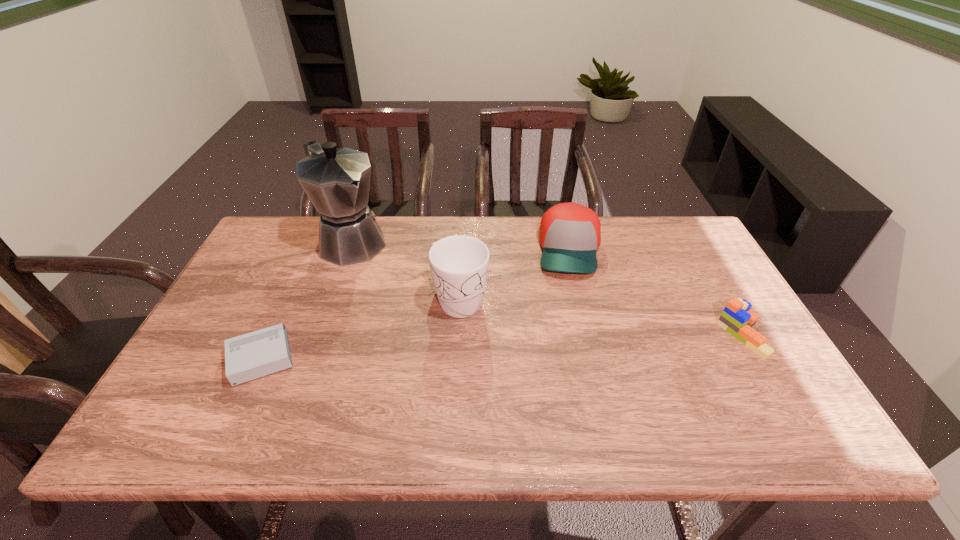
Image resolution: width=960 pixels, height=540 pixels. I want to click on blank region between the rightmost object and the tallest object, so click(x=546, y=288).

The width and height of the screenshot is (960, 540). I want to click on the closest object relative to the second object from right to left, so click(459, 264).

You are a GUI agent. You are given a task and a screenshot of the screen. Output one action in this format:
    pyautogui.click(x=<x>, y=<y>)
    Task: Click on the third closest object to the coffeepot
    Image resolution: width=960 pixels, height=540 pixels.
    Given the screenshot: What is the action you would take?
    pyautogui.click(x=570, y=234)

Find the location of `free spot that satisfies the following two spatial constraints: 1. on the back side of the mug; 2. on the right side of the shortest object`. free spot that satisfies the following two spatial constraints: 1. on the back side of the mug; 2. on the right side of the shortest object is located at coordinates (288, 300).

Where is `free space that satisfies the following two spatial constraints: 1. on the front side of the tallest object; 2. on the left side of the second shortest object`? This screenshot has height=540, width=960. free space that satisfies the following two spatial constraints: 1. on the front side of the tallest object; 2. on the left side of the second shortest object is located at coordinates (318, 335).

Locate an element on the screen. The width and height of the screenshot is (960, 540). vacant position in the image that satisfies the following two spatial constraints: 1. on the front side of the fourth object from left to right; 2. on the right side of the fourth tallest object is located at coordinates (589, 335).

The image size is (960, 540). In order to click on free space that satisfies the following two spatial constraints: 1. on the front side of the tallest object; 2. on the left side of the second tallest object in this screenshot , I will do `click(330, 300)`.

Where is `free location that satisfies the following two spatial constraints: 1. on the front side of the mug; 2. on the right side of the tallest object`? The image size is (960, 540). free location that satisfies the following two spatial constraints: 1. on the front side of the mug; 2. on the right side of the tallest object is located at coordinates (330, 300).